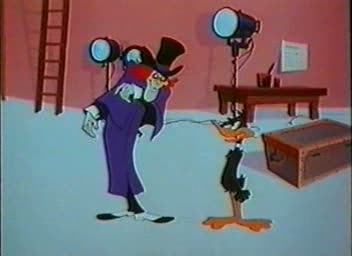
In order to click on lights in this screenshot , I will do `click(224, 23)`, `click(131, 53)`, `click(98, 57)`.